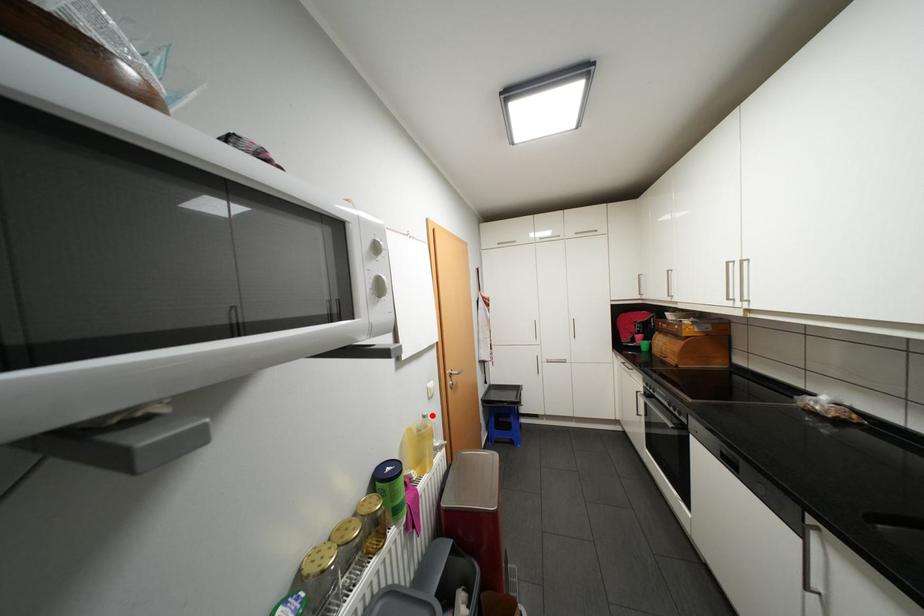
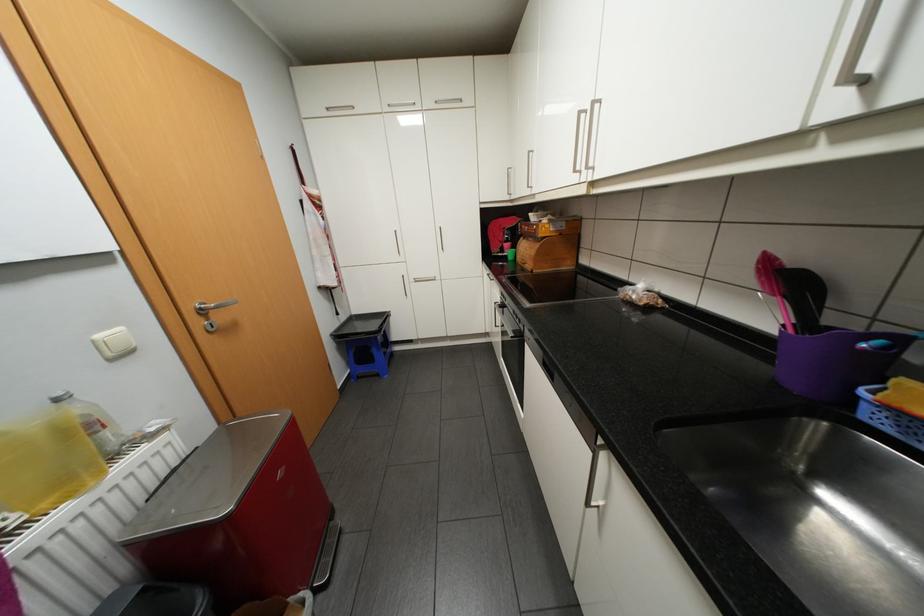
Question: I am providing you with two images of the same scene from different viewpoints. In image1, a red point is highlighted. Considering the same 3D point in image2, which of the following is correct?

Choices:
 (A) It is closer
 (B) It is farther

Answer: (A)